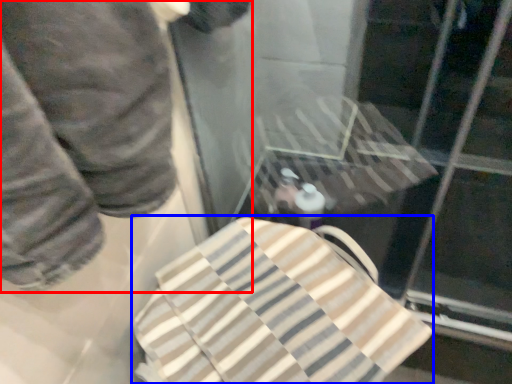
Question: Which point is further to the camera, person (highlighted by a red box) or beach towel (highlighted by a blue box)?

Choices:
 (A) person
 (B) beach towel

Answer: (B)